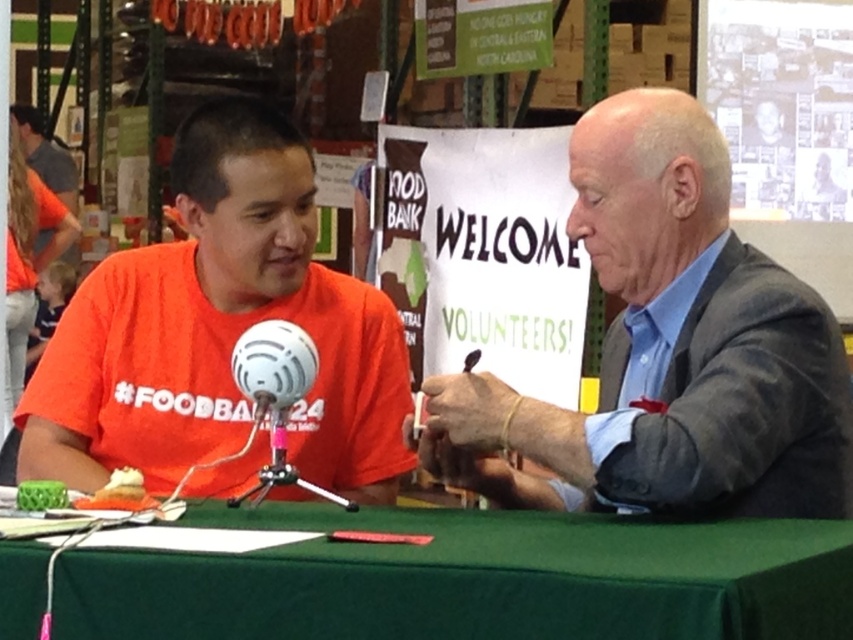
Does gray suit jacket at right lie behind green fabric table at center?

That is True.

Measure the distance from gray suit jacket at right to green fabric table at center.

gray suit jacket at right and green fabric table at center are 11.17 inches apart from each other.

Where is `gray suit jacket at right`? gray suit jacket at right is located at coordinates (668, 349).

Locate an element on the screen. The image size is (853, 640). gray suit jacket at right is located at coordinates pos(668,349).

Is green fabric table at center bigger than orange t-shirt at left?

No.

Is green fabric table at center taller than orange t-shirt at left?

No.

Between point (550, 538) and point (236, 467), which one is positioned in front?

Positioned in front is point (550, 538).

Identify the location of green fabric table at center. (469, 579).

Identify the location of gray suit jacket at right. (668, 349).

Does gray suit jacket at right appear under orange t-shirt at left?

Yes.

Describe the element at coordinates (668, 349) in the screenshot. Image resolution: width=853 pixels, height=640 pixels. I see `gray suit jacket at right` at that location.

Identify the location of gray suit jacket at right. (668, 349).